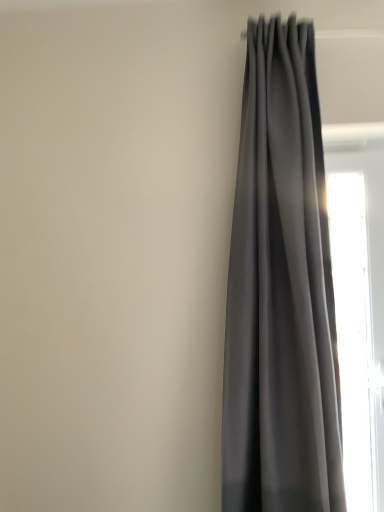
The height and width of the screenshot is (512, 384). In order to click on matte gray curtain at right in this screenshot , I will do point(281,291).

Looking at this image, measure the distance between point (300, 34) and camera.

They are 4.98 feet apart.

The image size is (384, 512). Describe the element at coordinates (281, 291) in the screenshot. I see `matte gray curtain at right` at that location.

The height and width of the screenshot is (512, 384). In order to click on matte gray curtain at right in this screenshot , I will do `click(281, 291)`.